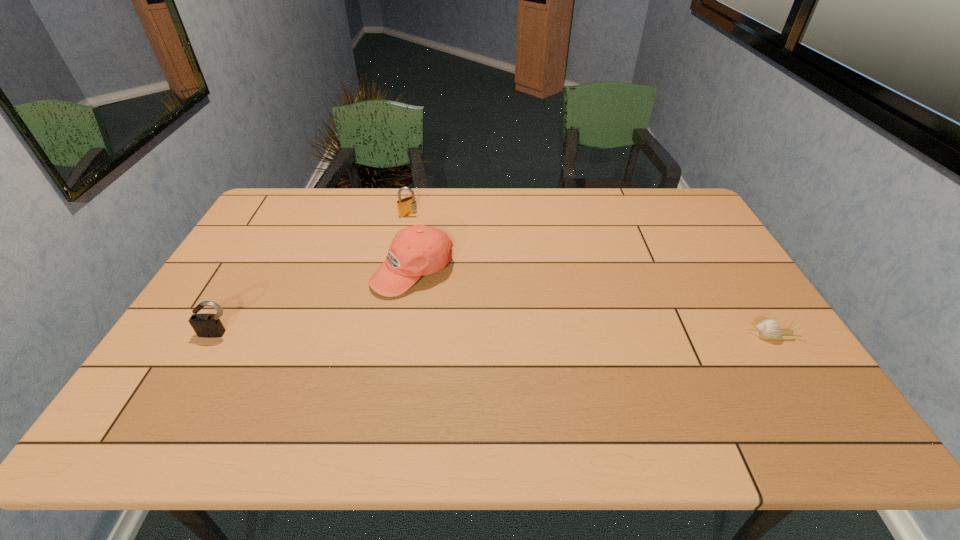
Locate an element on the screen. This screenshot has width=960, height=540. free spot on the desktop that is between the nearer padlock and the shortest object and is positioned on the side with the combination dials of the farthest object is located at coordinates (x=538, y=335).

Find the location of a particular element. This screenshot has height=540, width=960. free space on the desktop that is between the leftmost object and the rightmost object and is positioned on the front-facing side of the baseball cap is located at coordinates (420, 334).